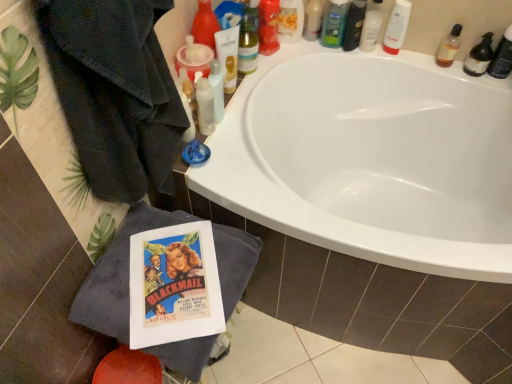
Question: From a real-world perspective, relative to translucent plastic bottle at upper center, the 9th toiletry positioned from the right, is translucent plastic bottle at upper right, which ranks as the 2th toiletry in right-to-left order, vertically above or below?

Choices:
 (A) below
 (B) above

Answer: (A)

Question: In terms of size, does translucent plastic bottle at upper right, which ranks as the 2th toiletry in right-to-left order, appear bigger or smaller than translucent plastic bottle at upper center, which is the 1th toiletry in left-to-right order?

Choices:
 (A) small
 (B) big

Answer: (A)

Question: Estimate the real-world distances between objects in this image. Which object is farther from the shiny plastic bottle at upper center, the 2th toiletry from the left?

Choices:
 (A) translucent plastic bottle at upper right, arranged as the 8th toiletry when viewed from the left
 (B) green matte bottle at upper center, the 6th toiletry from the right
 (C) vintage paper comic book at lower left
 (D) translucent plastic bottle at upper center, the 7th toiletry in the right-to-left sequence
 (E) translucent plastic tube at upper center, the second mouthwash viewed from the right

Answer: (C)

Question: Based on their relative distances, which object is nearer to the translucent plastic mouthwash at upper right, marked as the 2th mouthwash in a left-to-right arrangement?

Choices:
 (A) gray cotton bath towel at lower left
 (B) shiny plastic bottle at upper right, which appears as the fifth toiletry when viewed from the right
 (C) shiny plastic bottle at upper center, the 2th toiletry from the left
 (D) translucent plastic bottle at upper center, the 7th toiletry in the right-to-left sequence
 (E) translucent plastic bottle at upper right, the 1th toiletry in the right-to-left sequence

Answer: (E)